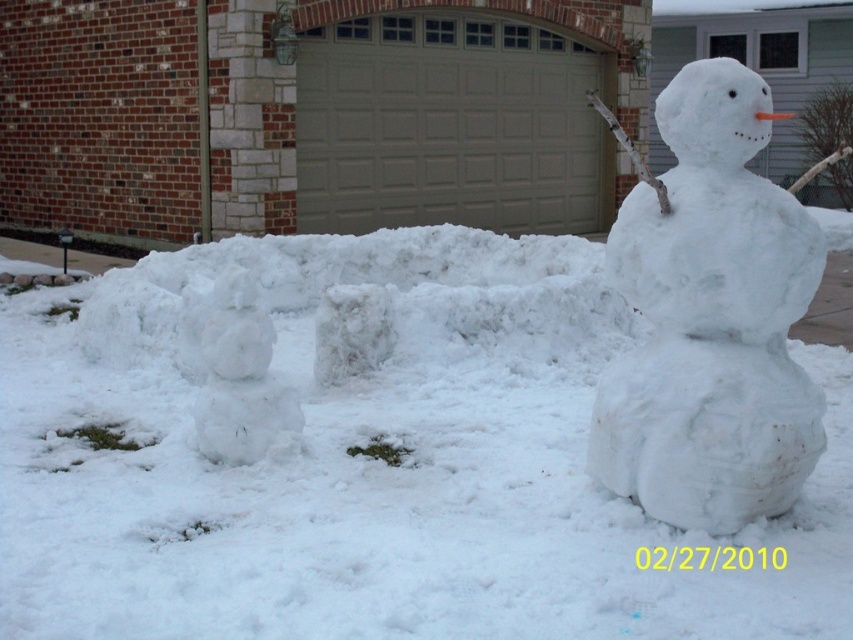
Question: Which point is farther from the camera taking this photo?

Choices:
 (A) (561, 150)
 (B) (247, 307)
 (C) (798, 272)
 (D) (840, 452)

Answer: (A)

Question: Can you confirm if gray matte/glossy garage door at center is positioned to the left of white fluffy snowman at lower left?

Choices:
 (A) no
 (B) yes

Answer: (A)

Question: Which is nearer to the white fluffy snow at center?

Choices:
 (A) white fluffy snowman at right
 (B) white fluffy snowman at lower left

Answer: (B)

Question: Can you confirm if white fluffy snowman at right is thinner than white fluffy snowman at lower left?

Choices:
 (A) yes
 (B) no

Answer: (B)

Question: Which object is positioned farthest from the white fluffy snow at center?

Choices:
 (A) white fluffy snowman at right
 (B) gray matte/glossy garage door at center

Answer: (B)

Question: Is white fluffy snow at center above white fluffy snowman at lower left?

Choices:
 (A) yes
 (B) no

Answer: (B)